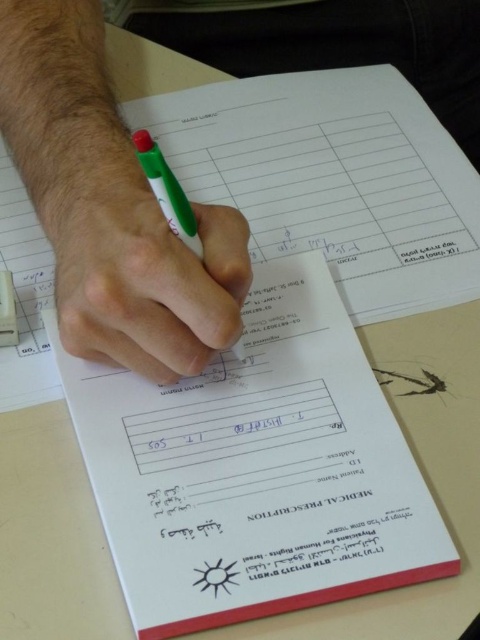
Does white paper at center appear on the right side of green plastic pen at upper left?

Indeed, white paper at center is positioned on the right side of green plastic pen at upper left.

Describe the element at coordinates (255, 468) in the screenshot. This screenshot has height=640, width=480. I see `white paper at center` at that location.

The height and width of the screenshot is (640, 480). What are the coordinates of `white paper at center` in the screenshot? It's located at (255, 468).

Locate an element on the screen. Image resolution: width=480 pixels, height=640 pixels. white paper at center is located at coordinates (255, 468).

Describe the element at coordinates (255, 468) in the screenshot. I see `white paper at center` at that location.

Does white paper at center have a lesser width compared to green plastic pen at center?

Incorrect, white paper at center's width is not less than green plastic pen at center's.

Identify the location of white paper at center. (255, 468).

The height and width of the screenshot is (640, 480). What are the coordinates of `white paper at center` in the screenshot? It's located at (255, 468).

Does green plastic pen at upper left have a lesser width compared to green matte pen at center?

In fact, green plastic pen at upper left might be wider than green matte pen at center.

Who is more distant from viewer, (241, 260) or (208, 212)?

Positioned behind is point (208, 212).

Who is more distant from viewer, (48, 157) or (76, 193)?

The point (48, 157) is behind.

Where is `green plastic pen at upper left`? The width and height of the screenshot is (480, 640). green plastic pen at upper left is located at coordinates (109, 205).